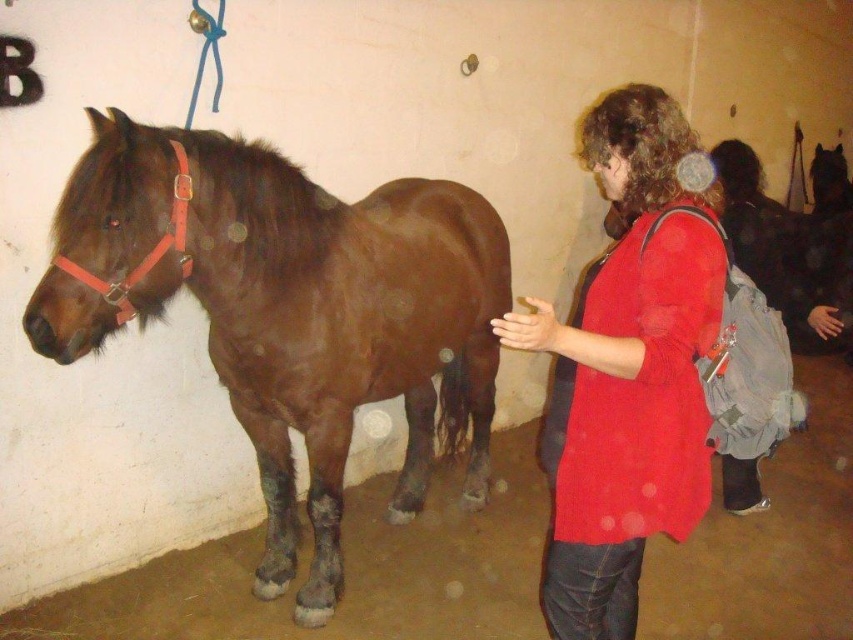
Question: Is brown glossy horse at left positioned at the back of matte red shirt at center?

Choices:
 (A) yes
 (B) no

Answer: (A)

Question: Which object appears farthest from the camera in this image?

Choices:
 (A) matte red shirt at center
 (B) brown glossy horse at left

Answer: (B)

Question: Which of the following is the closest to the observer?

Choices:
 (A) (532, 337)
 (B) (213, 276)

Answer: (A)

Question: Does brown glossy horse at left appear on the left side of matte red shirt at center?

Choices:
 (A) no
 (B) yes

Answer: (B)

Question: Can you confirm if brown glossy horse at left is thinner than matte red shirt at center?

Choices:
 (A) no
 (B) yes

Answer: (A)